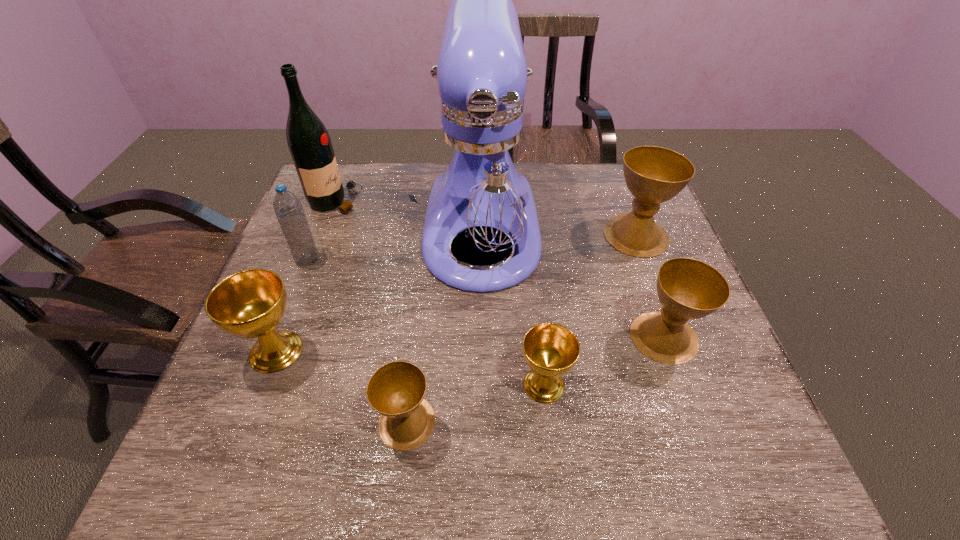
Locate an element on the screen. Image resolution: width=960 pixels, height=540 pixels. the leftmost brown chalice is located at coordinates (x=396, y=390).

What are the coordinates of `the smallest brown chalice` in the screenshot? It's located at (396, 390).

The height and width of the screenshot is (540, 960). I want to click on the third chalice from right to left, so click(551, 350).

What are the coordinates of `the right gold chalice` in the screenshot? It's located at (551, 350).

Where is `vacant space located 0.130m at the mixing area of the blue mixer`? The height and width of the screenshot is (540, 960). vacant space located 0.130m at the mixing area of the blue mixer is located at coordinates (482, 354).

You are a GUI agent. You are given a task and a screenshot of the screen. Output one action in this format:
    pyautogui.click(x=<x>, y=<y>)
    Task: Click on the free space located on the surface of the seventh shortest object
    Image resolution: width=960 pixels, height=540 pixels.
    Given the screenshot: What is the action you would take?
    pyautogui.click(x=478, y=201)

At what (x,y) coordinates should I click in order to perform the action: click on free space located on the left of the farthest chalice. Please return your answer as a coordinate pair (x, y). The width and height of the screenshot is (960, 540). Looking at the image, I should click on (541, 235).

At what (x,y) coordinates should I click in order to perform the action: click on vacant area situated on the back of the blue water bottle. Please return your answer as a coordinate pair (x, y). Image resolution: width=960 pixels, height=540 pixels. Looking at the image, I should click on (337, 186).

Identify the location of free space located 0.240m on the front of the second biggest brown chalice. The image size is (960, 540). (717, 485).

At what (x,y) coordinates should I click in order to perform the action: click on vacant region located 0.380m on the right of the leftmost chalice. Please return your answer as a coordinate pair (x, y). Image resolution: width=960 pixels, height=540 pixels. Looking at the image, I should click on (487, 351).